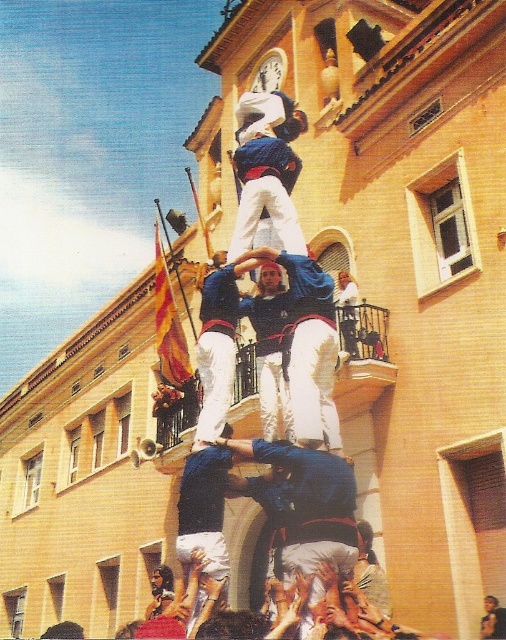
You are a photographer trying to capture the castells human tower. You notice a blue fabric shirt at center at point (310, 348). Where should you focus your camera to ensure the blue fabric shirt at center is in the frame?

The blue fabric shirt at center is located at point (310, 348), so you should focus your camera on that coordinate to ensure it is in the frame.

You are a photographer trying to capture the human tower. You notice the blue fabric shirt at center and the blue denim jeans at center. Which clothing item is located higher in the tower?

The blue fabric shirt at center is positioned over the blue denim jeans at center, so the blue fabric shirt at center is higher in the tower.

You are a photographer trying to capture the human tower. You want to focus on the blue fabric shirt at center. Based on its position, where should you aim your camera?

The blue fabric shirt at center is located at coordinates point (310, 348), so aim your camera at that point to capture it.